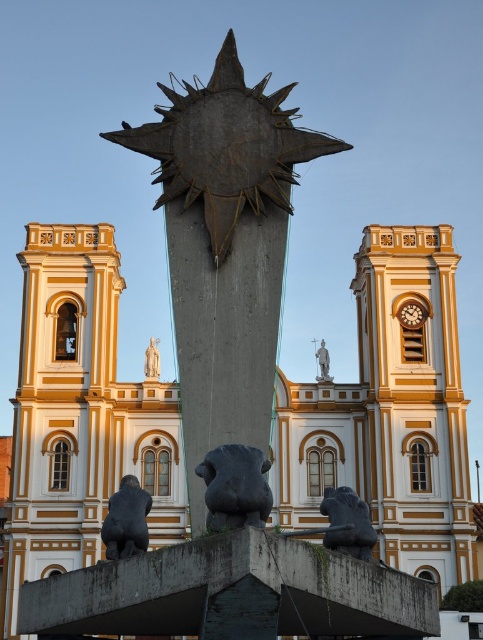
Is black stone bear at center above metallic clock face at center?

No.

Is point (237, 497) more distant than point (420, 323)?

No, it is not.

Find the location of `black stone bear at center`. black stone bear at center is located at coordinates (235, 486).

Is gold/golden stone church at center to the left of metallic clock face at center from the viewer's perspective?

Indeed, gold/golden stone church at center is positioned on the left side of metallic clock face at center.

Does gold/golden stone church at center have a lesser height compared to metallic clock face at center?

Incorrect, gold/golden stone church at center's height does not fall short of metallic clock face at center's.

Which is in front, point (71, 465) or point (412, 310)?

Point (71, 465) is more forward.

Identify the location of gold/golden stone church at center. (388, 413).

Is black stone bear at center taller than dark gray stone lion at lower center?

Incorrect, black stone bear at center's height is not larger of dark gray stone lion at lower center's.

You are a GUI agent. You are given a task and a screenshot of the screen. Output one action in this format:
    pyautogui.click(x=<x>, y=<y>)
    Task: Click on the black stone bear at center
    
    Given the screenshot: What is the action you would take?
    pyautogui.click(x=235, y=486)